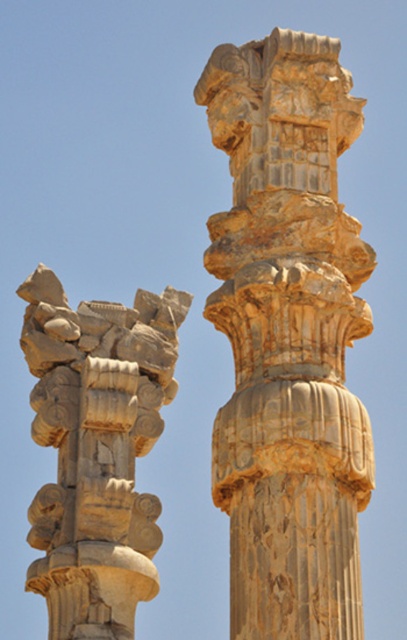
Does golden stone column at center appear under carved stone column at left?

Actually, golden stone column at center is above carved stone column at left.

Who is lower down, golden stone column at center or carved stone column at left?

carved stone column at left

Between point (348, 515) and point (32, 538), which one is positioned in front?

Point (348, 515) is more forward.

This screenshot has height=640, width=407. What are the coordinates of `golden stone column at center` in the screenshot? It's located at (288, 337).